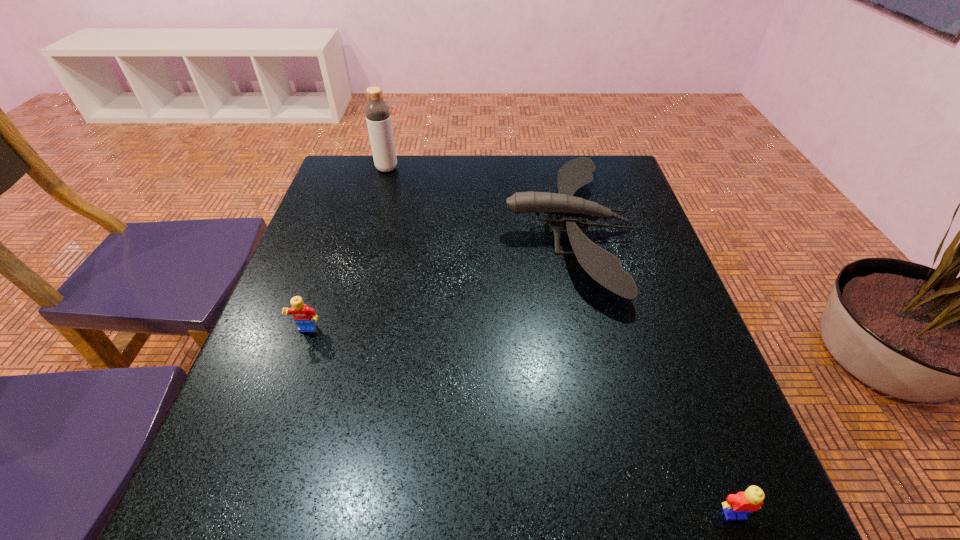
You are a GUI agent. You are given a task and a screenshot of the screen. Output one action in this format:
    pyautogui.click(x=<x>, y=<y>)
    Task: Click on the vacant position located at the head of the drone
    The height and width of the screenshot is (540, 960).
    Given the screenshot: What is the action you would take?
    pyautogui.click(x=367, y=230)

Identify the location of vacant area situated 0.080m on the face of the farther Lego. (293, 373).

You are a GUI agent. You are given a task and a screenshot of the screen. Output one action in this format:
    pyautogui.click(x=<x>, y=<y>)
    Task: Click on the bottle present at the far edge
    The width and height of the screenshot is (960, 540).
    Given the screenshot: What is the action you would take?
    pyautogui.click(x=377, y=112)

Where is `drone that is at the far edge`? drone that is at the far edge is located at coordinates (604, 267).

Where is `object that is at the near edge`? The image size is (960, 540). object that is at the near edge is located at coordinates (751, 500).

Where is `bottle present at the left edge`? bottle present at the left edge is located at coordinates (377, 112).

Where is `Lego situated at the left edge`? Lego situated at the left edge is located at coordinates (305, 317).

Locate an element on the screen. The image size is (960, 540). drone located in the right edge section of the desktop is located at coordinates (604, 267).

Find the location of a particular element. Image resolution: width=960 pixels, height=540 pixels. Lego that is positioned at the right edge is located at coordinates (751, 500).

At what (x,y) coordinates should I click in order to perform the action: click on object that is at the far left corner. Please return your answer as a coordinate pair (x, y). Looking at the image, I should click on (377, 112).